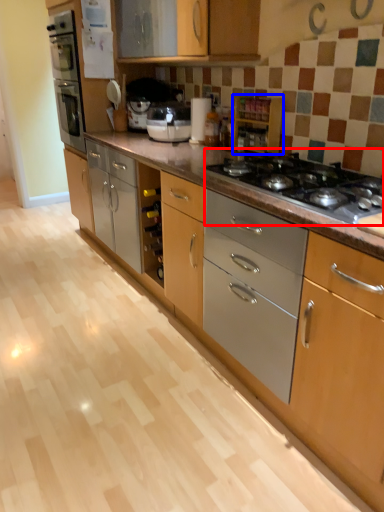
Question: Which of the following is the closest to the observer, gas stove (highlighted by a red box) or cabinetry (highlighted by a blue box)?

Choices:
 (A) gas stove
 (B) cabinetry

Answer: (A)